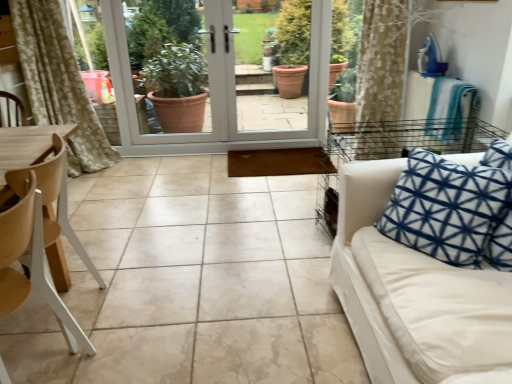
Locate an element on the screen. This screenshot has width=512, height=384. unoccupied area behind wooden at left, placed as the 1th chair when sorted from back to front is located at coordinates (114, 258).